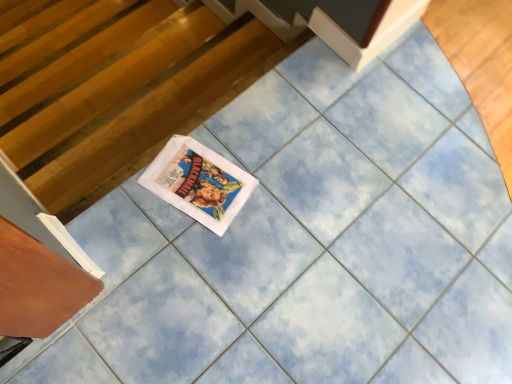
Find the location of a particular element. The height and width of the screenshot is (384, 512). vacant space situated above wooden at left (from a real-world perspective) is located at coordinates [x=143, y=112].